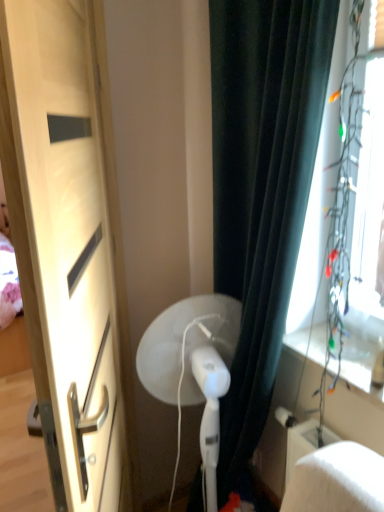
Question: Considering the relative sizes of matte wood door at left and white plastic fan at center in the image provided, is matte wood door at left wider than white plastic fan at center?

Choices:
 (A) yes
 (B) no

Answer: (B)

Question: Would you say matte wood door at left contains white plastic fan at center?

Choices:
 (A) yes
 (B) no

Answer: (B)

Question: From a real-world perspective, does matte wood door at left sit lower than white plastic fan at center?

Choices:
 (A) no
 (B) yes

Answer: (A)

Question: Does matte wood door at left have a smaller size compared to white plastic fan at center?

Choices:
 (A) yes
 (B) no

Answer: (B)

Question: Is the position of matte wood door at left more distant than that of white plastic fan at center?

Choices:
 (A) no
 (B) yes

Answer: (A)

Question: In terms of width, does transparent plastic window screen at right look wider or thinner when compared to dark green fabric curtain at right?

Choices:
 (A) wide
 (B) thin

Answer: (B)

Question: Is transparent plastic window screen at right in front of or behind dark green fabric curtain at right in the image?

Choices:
 (A) front
 (B) behind

Answer: (A)

Question: Is transparent plastic window screen at right inside or outside of dark green fabric curtain at right?

Choices:
 (A) outside
 (B) inside

Answer: (A)

Question: From a real-world perspective, is transparent plastic window screen at right positioned above or below dark green fabric curtain at right?

Choices:
 (A) above
 (B) below

Answer: (A)

Question: From the image's perspective, relative to dark green fabric curtain at right, is white plastic fan at center above or below?

Choices:
 (A) below
 (B) above

Answer: (A)

Question: Considering the relative positions of white plastic fan at center and dark green fabric curtain at right in the image provided, is white plastic fan at center to the left or to the right of dark green fabric curtain at right?

Choices:
 (A) left
 (B) right

Answer: (A)

Question: From their relative heights in the image, would you say white plastic fan at center is taller or shorter than dark green fabric curtain at right?

Choices:
 (A) tall
 (B) short

Answer: (B)

Question: Considering their positions, is white plastic fan at center located in front of or behind dark green fabric curtain at right?

Choices:
 (A) behind
 (B) front

Answer: (A)

Question: Looking at their shapes, would you say white plastic fan at center is wider or thinner than matte wood door at left?

Choices:
 (A) thin
 (B) wide

Answer: (B)

Question: Considering the positions of white plastic fan at center and matte wood door at left in the image, is white plastic fan at center bigger or smaller than matte wood door at left?

Choices:
 (A) small
 (B) big

Answer: (A)